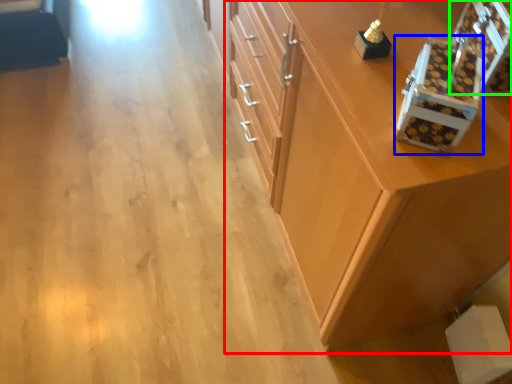
Question: Based on their relative distances, which object is farther from cabinetry (highlighted by a red box)? Choose from box (highlighted by a blue box) and box (highlighted by a green box).

Choices:
 (A) box
 (B) box

Answer: (B)